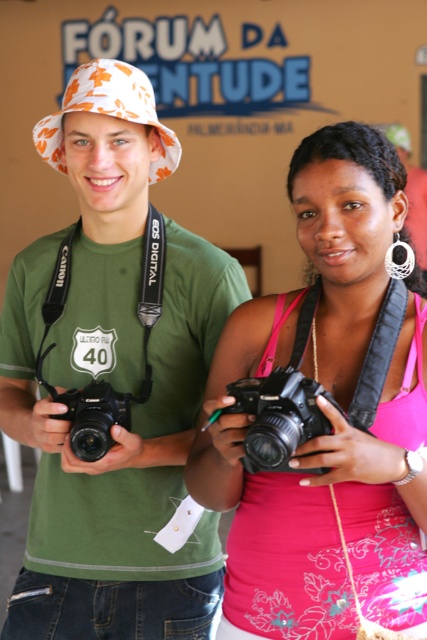
Who is higher up, matte green t-shirt at center or pink fabric tank top at center?

matte green t-shirt at center

What are the coordinates of `matte green t-shirt at center` in the screenshot? It's located at (114, 381).

Find the location of a particular element. This screenshot has height=640, width=427. matte green t-shirt at center is located at coordinates 114,381.

The width and height of the screenshot is (427, 640). Describe the element at coordinates (114, 381) in the screenshot. I see `matte green t-shirt at center` at that location.

Can you confirm if matte green t-shirt at center is positioned to the right of matte black camera at center?

Correct, you'll find matte green t-shirt at center to the right of matte black camera at center.

This screenshot has width=427, height=640. What do you see at coordinates (114, 381) in the screenshot?
I see `matte green t-shirt at center` at bounding box center [114, 381].

I want to click on matte green t-shirt at center, so click(114, 381).

Between point (222, 451) and point (120, 422), which one is positioned in front?

Point (222, 451) is more forward.

Is point (304, 236) closer to viewer compared to point (72, 412)?

Yes, it is in front of point (72, 412).

At what (x,y) coordinates should I click in order to perform the action: click on pink fabric tank top at center. Please return your answer as a coordinate pair (x, y). Looking at the image, I should click on (330, 416).